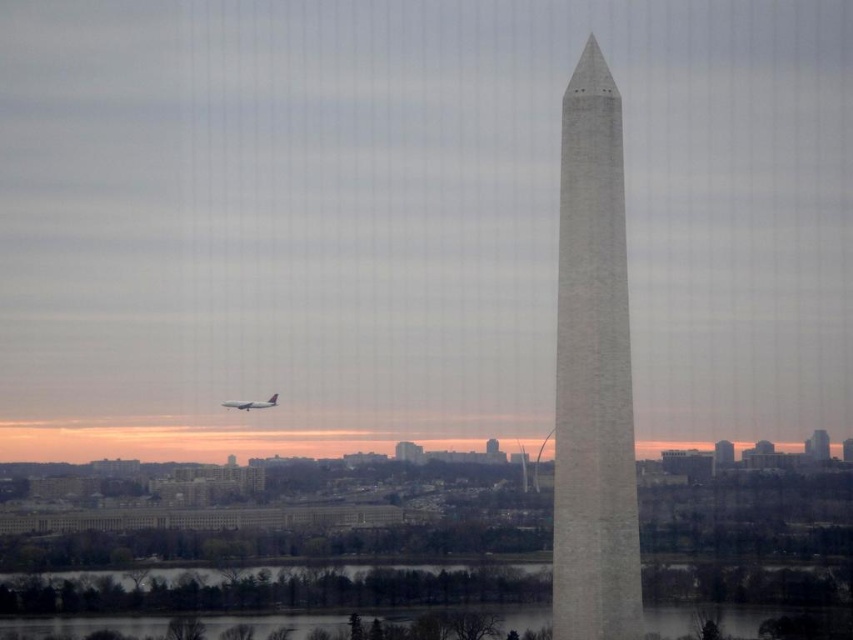
Question: Which of the following is the closest to the observer?

Choices:
 (A) (611, 586)
 (B) (276, 403)

Answer: (B)

Question: Is white stone tower at center to the left of metallic silver airplane at lower left from the viewer's perspective?

Choices:
 (A) no
 (B) yes

Answer: (A)

Question: Does white stone tower at center appear on the right side of metallic silver airplane at lower left?

Choices:
 (A) yes
 (B) no

Answer: (A)

Question: Does white stone tower at center appear on the right side of metallic silver airplane at lower left?

Choices:
 (A) no
 (B) yes

Answer: (B)

Question: Which point is closer to the camera?

Choices:
 (A) (624, 236)
 (B) (242, 410)

Answer: (B)

Question: Which object is closer to the camera taking this photo?

Choices:
 (A) metallic silver airplane at lower left
 (B) white stone tower at center

Answer: (B)